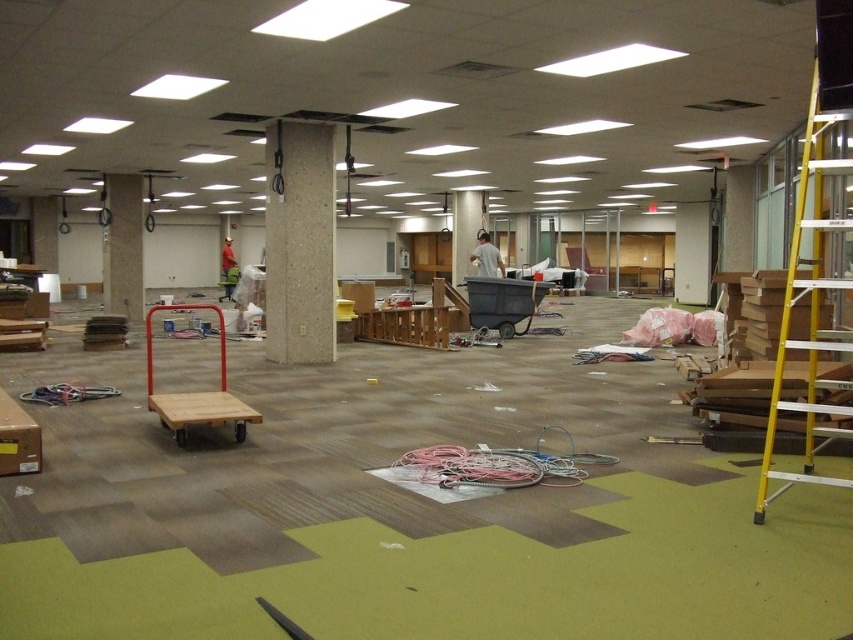
You are a construction worker in the room and need to store a tall tool that requires vertical space. Which object, the wooden cart at center or the black plastic bin at center, can accommodate the tool based on their heights?

The wooden cart at center is taller than the black plastic bin at center, so it can accommodate the tall tool that requires vertical space.

You are standing at the entrance of the room and want to place a new tool box exactly where the black plastic bin at center is currently located. Based on the coordinates provided, can you confirm the exact 2D position where you should place the tool box?

The black plastic bin at center is located at the 2D coordinates point [502,301], so you should place the tool box at that exact position.

You are a worker in the construction site and you need to move the black plastic bin at center to the yellow metallic ladder at right. Which object is closer to you so you can reach it first?

Result: The yellow metallic ladder at right is closer to the viewer than the black plastic bin at center, so you can reach it first.